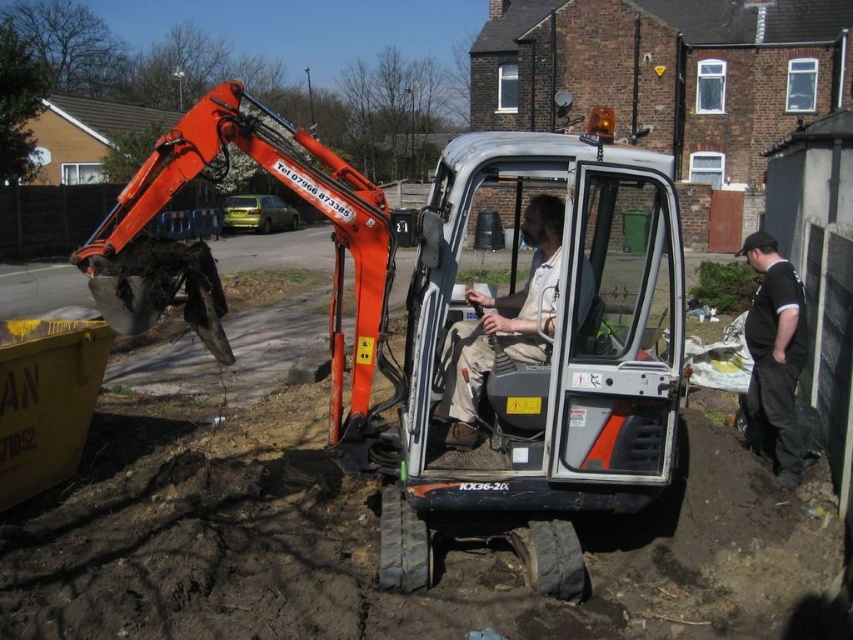
Looking at this image, is camouflage fabric pants at center thinner than black cotton shirt at right?

Incorrect, camouflage fabric pants at center's width is not less than black cotton shirt at right's.

Which is below, camouflage fabric pants at center or black cotton shirt at right?

black cotton shirt at right

Between point (555, 301) and point (772, 248), which one is positioned in front?

Point (555, 301)

You are a GUI agent. You are given a task and a screenshot of the screen. Output one action in this format:
    pyautogui.click(x=<x>, y=<y>)
    Task: Click on the camouflage fabric pants at center
    Image resolution: width=853 pixels, height=640 pixels.
    Given the screenshot: What is the action you would take?
    pyautogui.click(x=502, y=324)